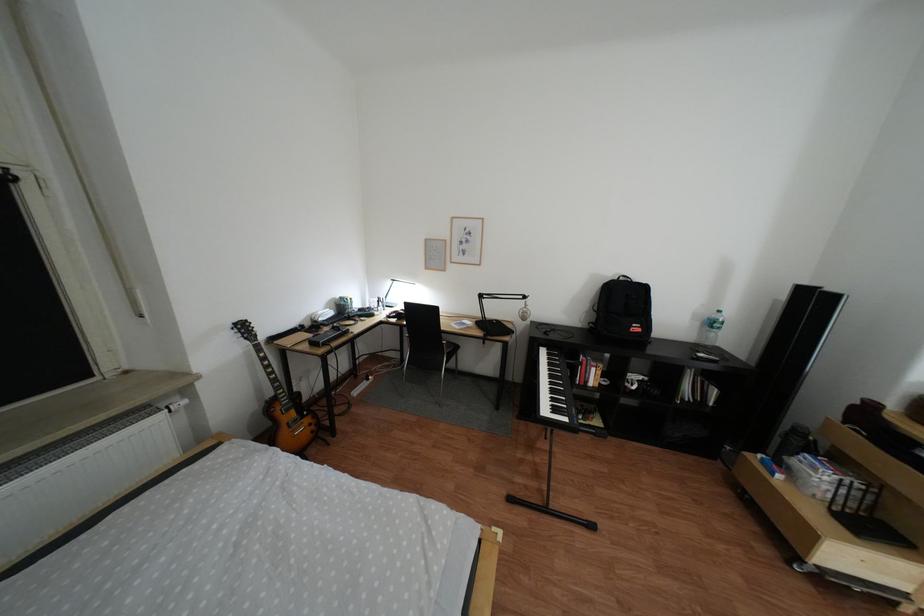
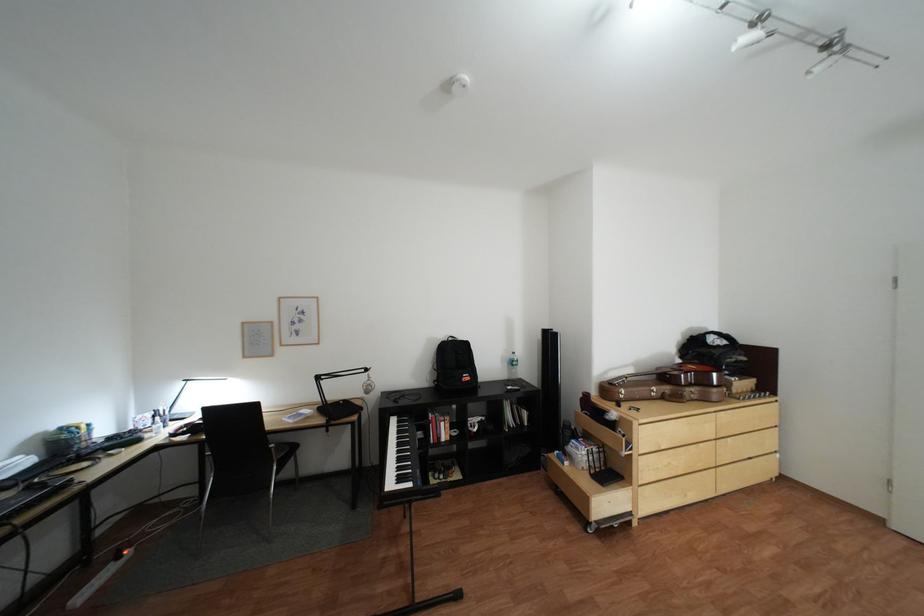
The point at (638,280) is marked in the first image. Where is the corresponding point in the second image?

(466, 339)